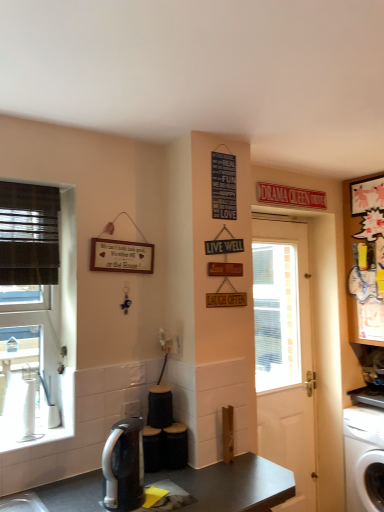
In order to click on unoccupied space behind sleek silver coffee maker at lower center in this screenshot , I will do `click(157, 478)`.